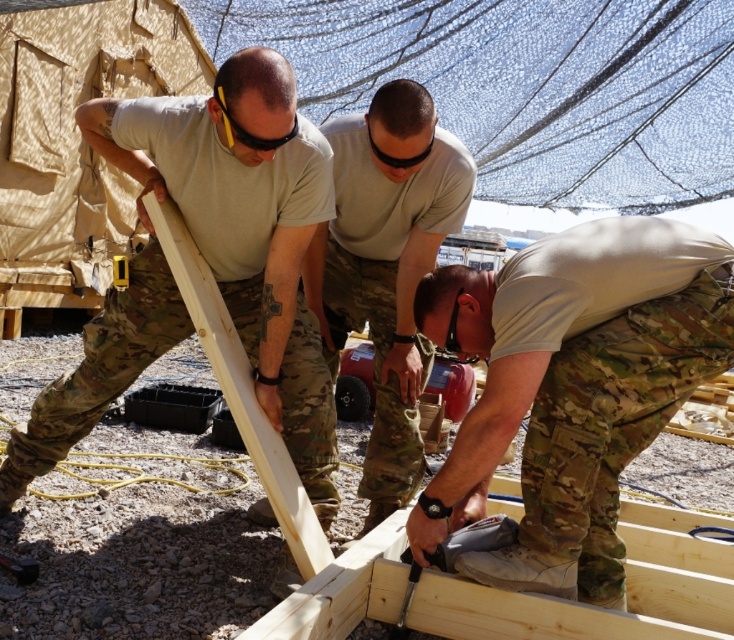
Locate an element on the screen. The image size is (734, 640). matte khaki shirt at center is located at coordinates (385, 266).

Between point (371, 337) and point (266, 465), which one is positioned in front?

Positioned in front is point (266, 465).

Measure the distance between point (352, 241) and camera.

The distance of point (352, 241) from camera is 9.94 feet.

Identify the location of matte khaki shirt at center. (385, 266).

Which is behind, point (586, 260) or point (232, 412)?

The point (232, 412) is behind.

Measure the distance between camouflage fabric pants at lower center and camera.

camouflage fabric pants at lower center and camera are 2.04 meters apart.

I want to click on camouflage fabric pants at lower center, so click(x=573, y=387).

Who is positioned more to the left, matte wood plank at left or metallic silver screwdriver at lower center?

Positioned to the left is matte wood plank at left.

Does matte wood plank at left appear on the left side of metallic silver screwdriver at lower center?

Indeed, matte wood plank at left is positioned on the left side of metallic silver screwdriver at lower center.

What do you see at coordinates (244, 227) in the screenshot? I see `matte wood plank at left` at bounding box center [244, 227].

What are the coordinates of `matte wood plank at left` in the screenshot? It's located at (244, 227).